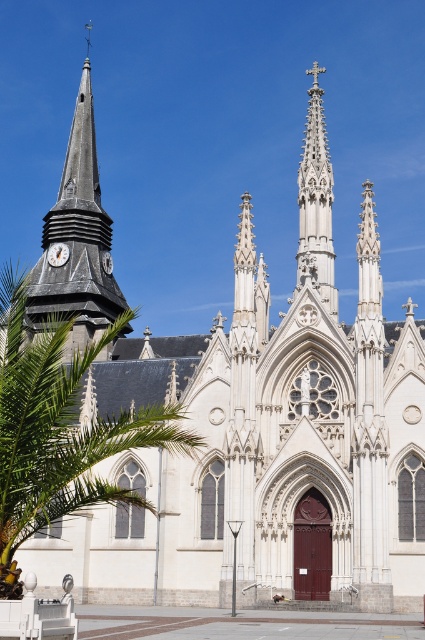
You are standing in front of the church and notice both the green leafy palm tree at left and the matte black clock at upper left. Which object is positioned to the right of the other?

The green leafy palm tree at left is positioned to the right of the matte black clock at upper left.

You are standing in front of the church and want to take a photo of the green leafy palm tree at left. Where should you position yourself relative to the church to ensure the palm tree is in the frame?

To include the green leafy palm tree at left in your photo, position yourself to the left side of the church since the green leafy palm tree at left is located at point (59, 428), which is to the left of the church.